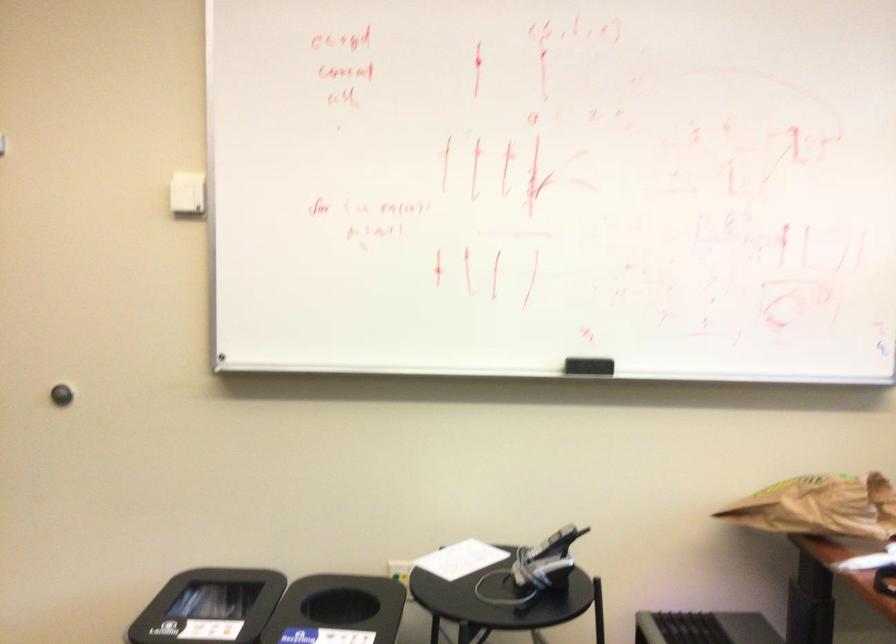
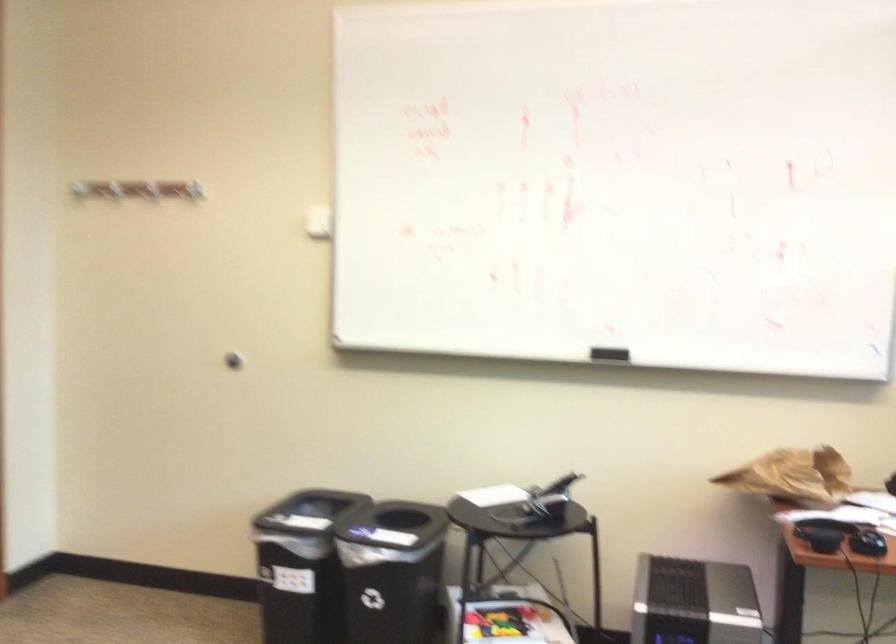
Where in the second image is the point corresponding to (x=193, y=187) from the first image?

(317, 222)